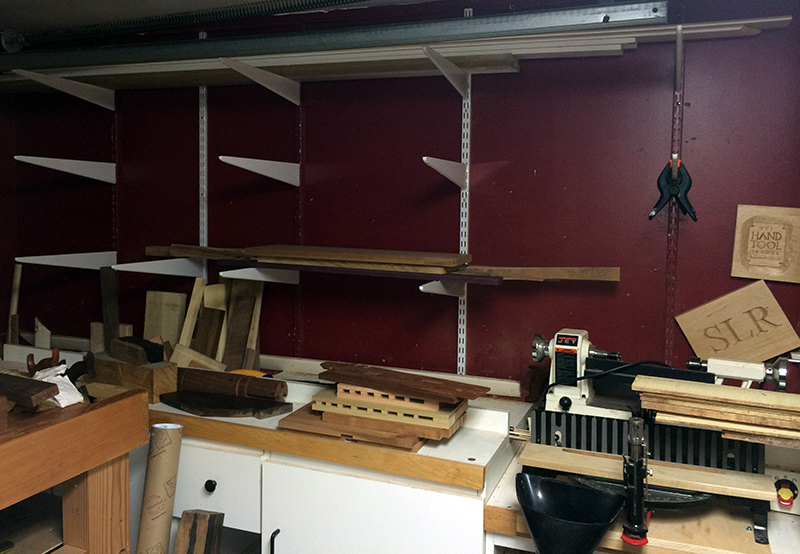
You are a GUI agent. You are given a task and a screenshot of the screen. Output one action in this format:
    pyautogui.click(x=<x>, y=<y>)
    Task: Click on the wooden workbench
    The height and width of the screenshot is (554, 800).
    Given the screenshot: What is the action you would take?
    click(x=46, y=461)